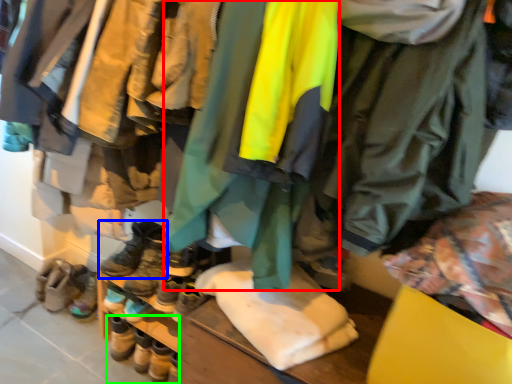
Question: Based on their relative distances, which object is farther from jacket (highlighted by a red box)? Choose from footwear (highlighted by a blue box) and footwear (highlighted by a green box).

Choices:
 (A) footwear
 (B) footwear

Answer: (B)